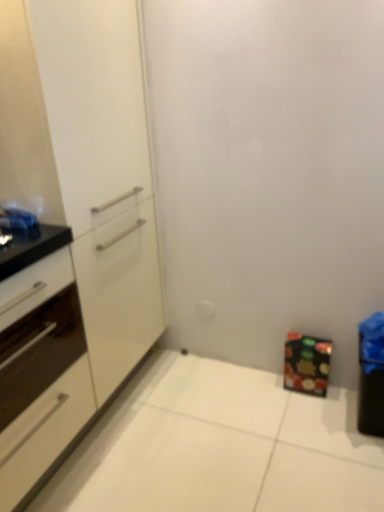
Question: From the image's perspective, would you say matte black cabinet at lower right, which appears as the 3th cabinetry when viewed from the left, is positioned over white glossy cabinet at left, the second cabinetry positioned from the right?

Choices:
 (A) no
 (B) yes

Answer: (A)

Question: Is matte black cabinet at lower right, the first cabinetry viewed from the right, closer to the viewer compared to white glossy cabinet at left, marked as the 2th cabinetry in a left-to-right arrangement?

Choices:
 (A) yes
 (B) no

Answer: (B)

Question: From a real-world perspective, is matte black cabinet at lower right, the first cabinetry viewed from the right, physically below white glossy cabinet at left, the second cabinetry positioned from the right?

Choices:
 (A) no
 (B) yes

Answer: (B)

Question: Is matte black cabinet at lower right, the first cabinetry viewed from the right, surrounding white glossy cabinet at left, the second cabinetry positioned from the right?

Choices:
 (A) no
 (B) yes

Answer: (A)

Question: From the image's perspective, would you say matte black cabinet at lower right, which appears as the 3th cabinetry when viewed from the left, is shown under white glossy cabinet at left, marked as the 2th cabinetry in a left-to-right arrangement?

Choices:
 (A) yes
 (B) no

Answer: (A)

Question: Is white glossy cabinet at left, marked as the 2th cabinetry in a left-to-right arrangement, at the back of matte black cabinet at lower right, which appears as the 3th cabinetry when viewed from the left?

Choices:
 (A) yes
 (B) no

Answer: (B)

Question: Is white glossy cabinet at left, marked as the 1th cabinetry in a left-to-right arrangement, completely or partially outside of white glossy cabinet at left, the second cabinetry positioned from the right?

Choices:
 (A) yes
 (B) no

Answer: (A)

Question: Does white glossy cabinet at left, which is counted as the 3th cabinetry, starting from the right, have a lesser height compared to white glossy cabinet at left, the second cabinetry positioned from the right?

Choices:
 (A) yes
 (B) no

Answer: (A)

Question: Can you confirm if white glossy cabinet at left, which is counted as the 3th cabinetry, starting from the right, is taller than white glossy cabinet at left, marked as the 2th cabinetry in a left-to-right arrangement?

Choices:
 (A) yes
 (B) no

Answer: (B)

Question: From the image's perspective, is white glossy cabinet at left, marked as the 1th cabinetry in a left-to-right arrangement, over white glossy cabinet at left, the second cabinetry positioned from the right?

Choices:
 (A) yes
 (B) no

Answer: (B)

Question: Can you confirm if white glossy cabinet at left, marked as the 1th cabinetry in a left-to-right arrangement, is positioned to the right of white glossy cabinet at left, the second cabinetry positioned from the right?

Choices:
 (A) no
 (B) yes

Answer: (A)

Question: Does white glossy cabinet at left, marked as the 1th cabinetry in a left-to-right arrangement, have a lesser width compared to white glossy cabinet at left, marked as the 2th cabinetry in a left-to-right arrangement?

Choices:
 (A) yes
 (B) no

Answer: (B)

Question: Is white glossy cabinet at left, which is counted as the 3th cabinetry, starting from the right, in front of matte black cabinet at lower right, the first cabinetry viewed from the right?

Choices:
 (A) yes
 (B) no

Answer: (A)